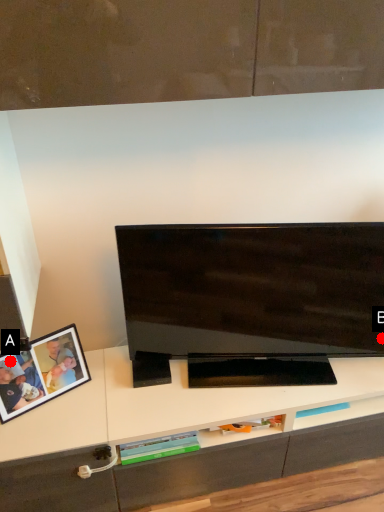
Question: Two points are circled on the image, labeled by A and B beside each circle. Which point is farther from the camera taking this photo?

Choices:
 (A) A is further
 (B) B is further

Answer: (B)